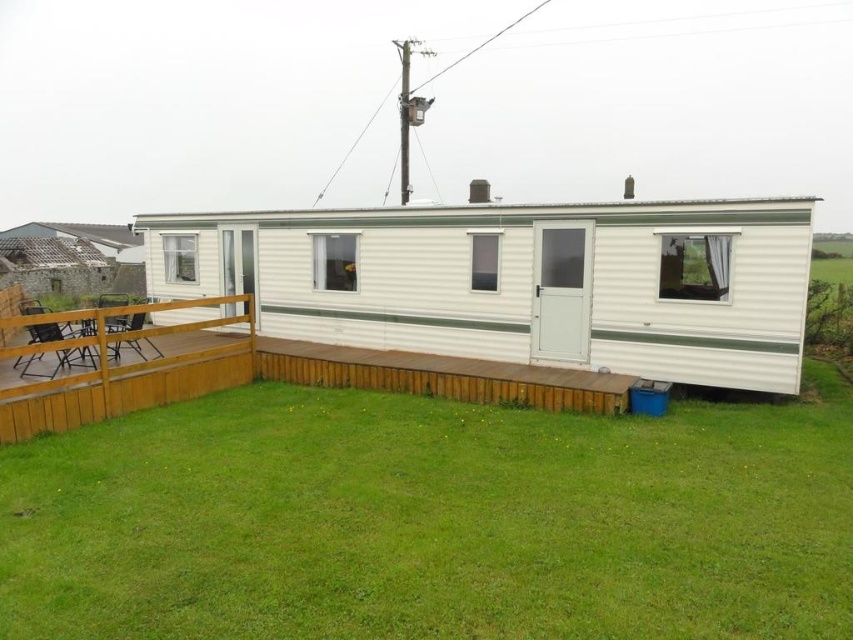
Question: Is green grass at lower center thinner than brown wooden deck at lower left?

Choices:
 (A) yes
 (B) no

Answer: (B)

Question: Among these objects, which one is farthest from the camera?

Choices:
 (A) brown wooden deck at lower left
 (B) green grass at lower center

Answer: (A)

Question: Which object appears farthest from the camera in this image?

Choices:
 (A) white corrugated metal trailer at center
 (B) green grass at lower center

Answer: (A)

Question: Does green grass at lower center come in front of brown wooden deck at lower left?

Choices:
 (A) no
 (B) yes

Answer: (B)

Question: Does white corrugated metal trailer at center have a smaller size compared to brown wooden deck at lower left?

Choices:
 (A) no
 (B) yes

Answer: (A)

Question: Which of these objects is positioned farthest from the green grass at lower center?

Choices:
 (A) brown wooden deck at lower left
 (B) white corrugated metal trailer at center

Answer: (B)